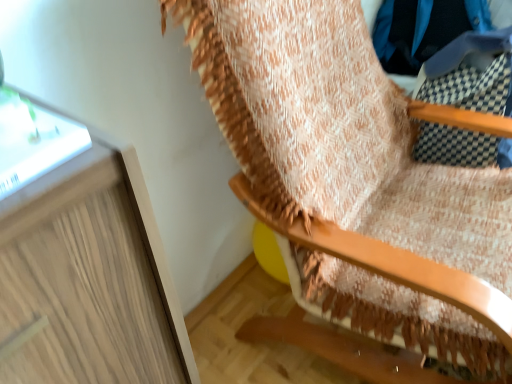
Question: Considering the positions of blue fabric at upper right and wooden rocking chair at upper right in the image, is blue fabric at upper right wider or thinner than wooden rocking chair at upper right?

Choices:
 (A) thin
 (B) wide

Answer: (A)

Question: Based on their sizes in the image, would you say blue fabric at upper right is bigger or smaller than wooden rocking chair at upper right?

Choices:
 (A) small
 (B) big

Answer: (A)

Question: Based on their positions, is blue fabric at upper right located to the left or right of wooden rocking chair at upper right?

Choices:
 (A) left
 (B) right

Answer: (B)

Question: Choose the correct answer: Is wooden rocking chair at upper right inside blue fabric at upper right or outside it?

Choices:
 (A) inside
 (B) outside

Answer: (B)

Question: From the image's perspective, is wooden rocking chair at upper right located above or below blue fabric at upper right?

Choices:
 (A) below
 (B) above

Answer: (A)

Question: Looking at their shapes, would you say wooden rocking chair at upper right is wider or thinner than blue fabric at upper right?

Choices:
 (A) wide
 (B) thin

Answer: (A)

Question: From a real-world perspective, is wooden rocking chair at upper right positioned above or below blue fabric at upper right?

Choices:
 (A) above
 (B) below

Answer: (B)